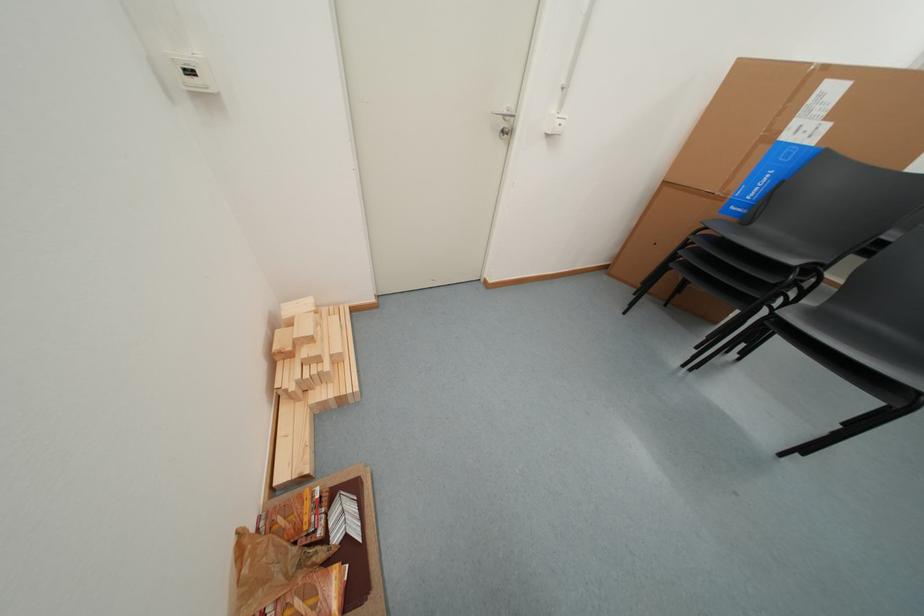
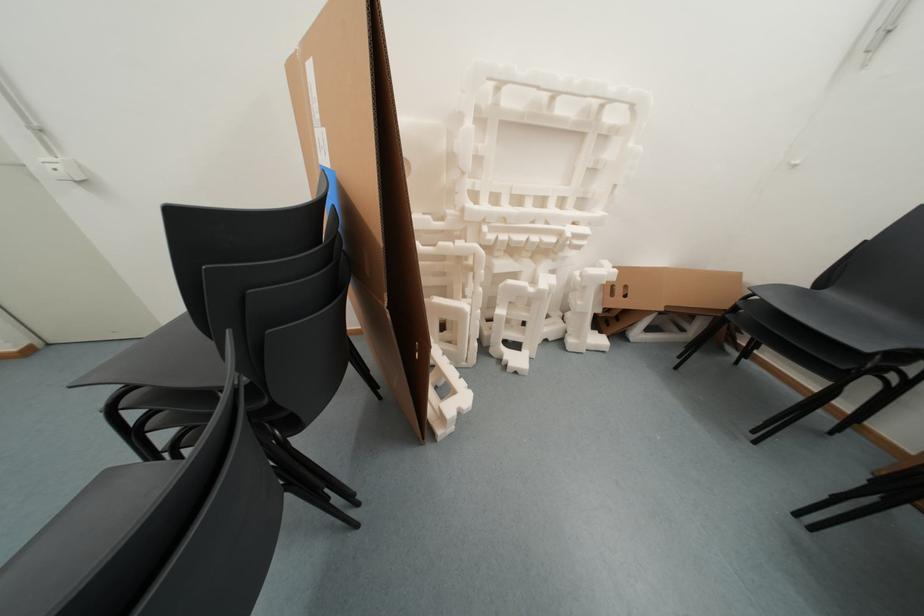
Question: Which direction would the cameraman need to move to produce the second image? Reply with the corresponding letter.

Choices:
 (A) Left
 (B) Right
 (C) Forward
 (D) Backward

Answer: (B)